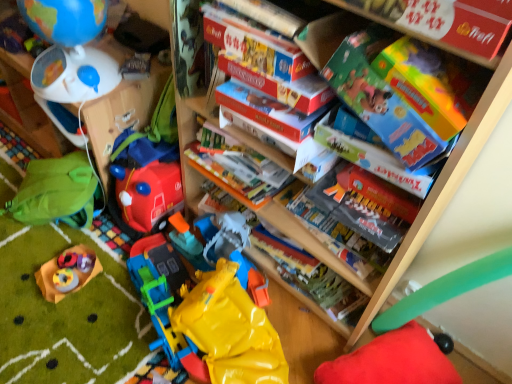
What are the coordinates of `free spot above red plastic toy car at lower left, placed as the 4th toy when sorted from left to right (from a real-world perspective)` in the screenshot? It's located at (144, 168).